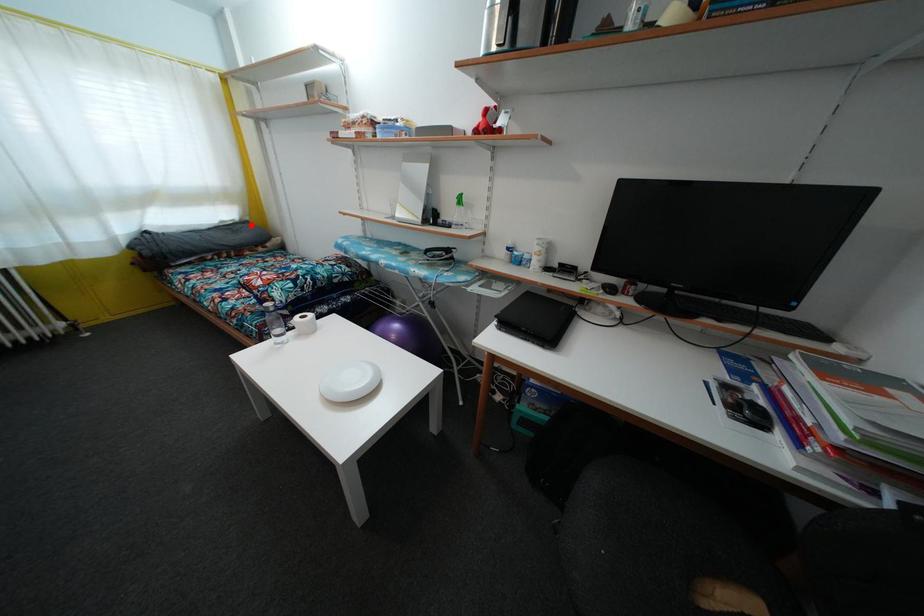
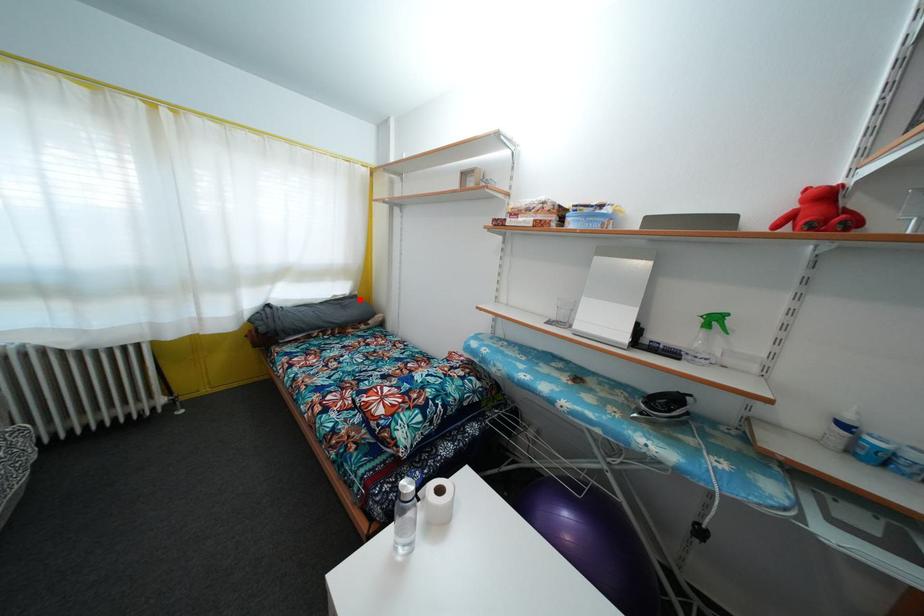
I am providing you with two images of the same scene from different viewpoints. A red point is marked on the first image and another point is marked on the second image. Is the marked point in image1 the same physical position as the marked point in image2?

Yes